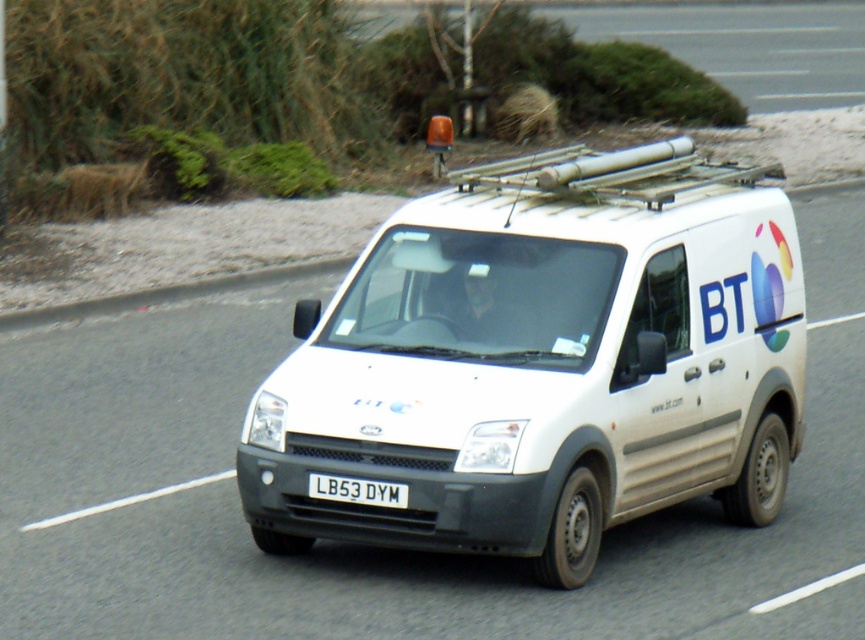
Question: Which point is farther to the camera?

Choices:
 (A) white matte van at center
 (B) white plastic license plate at center

Answer: (B)

Question: Which point appears farthest from the camera in this image?

Choices:
 (A) (308, 483)
 (B) (504, 536)

Answer: (A)

Question: Can you confirm if white matte van at center is positioned to the right of white plastic license plate at center?

Choices:
 (A) yes
 (B) no

Answer: (A)

Question: Can you confirm if white matte van at center is positioned above white plastic license plate at center?

Choices:
 (A) no
 (B) yes

Answer: (B)

Question: Which point is farther to the camera?

Choices:
 (A) white matte van at center
 (B) white plastic license plate at center

Answer: (B)

Question: Is white matte van at center behind white plastic license plate at center?

Choices:
 (A) no
 (B) yes

Answer: (A)